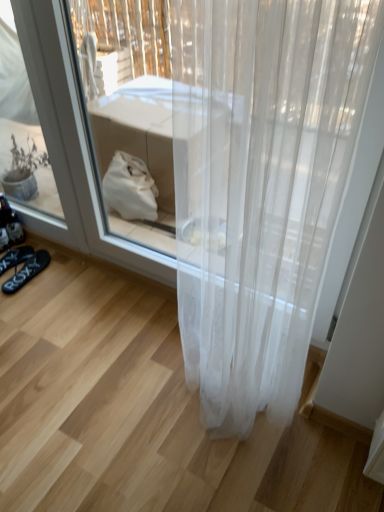
Question: Looking at their shapes, would you say black rubber flip-flops at lower left, arranged as the 2th footwear when viewed from the left, is wider or thinner than black rubber sandals at lower left, placed as the 1th footwear when sorted from left to right?

Choices:
 (A) thin
 (B) wide

Answer: (A)

Question: Is black rubber flip-flops at lower left, placed as the 1th footwear when sorted from right to left, bigger or smaller than black rubber sandals at lower left, placed as the 1th footwear when sorted from left to right?

Choices:
 (A) small
 (B) big

Answer: (B)

Question: Would you say black rubber flip-flops at lower left, arranged as the 2th footwear when viewed from the left, is to the left or to the right of black rubber sandals at lower left, placed as the 1th footwear when sorted from left to right, in the picture?

Choices:
 (A) left
 (B) right

Answer: (B)

Question: Considering the positions of black rubber sandals at lower left, placed as the 1th footwear when sorted from left to right, and black rubber flip-flops at lower left, placed as the 1th footwear when sorted from right to left, in the image, is black rubber sandals at lower left, placed as the 1th footwear when sorted from left to right, wider or thinner than black rubber flip-flops at lower left, placed as the 1th footwear when sorted from right to left,?

Choices:
 (A) thin
 (B) wide

Answer: (B)

Question: Is black rubber sandals at lower left, acting as the second footwear starting from the right, taller or shorter than black rubber flip-flops at lower left, placed as the 1th footwear when sorted from right to left?

Choices:
 (A) tall
 (B) short

Answer: (B)

Question: From the image's perspective, relative to black rubber flip-flops at lower left, arranged as the 2th footwear when viewed from the left, is black rubber sandals at lower left, placed as the 1th footwear when sorted from left to right, above or below?

Choices:
 (A) above
 (B) below

Answer: (A)

Question: Is black rubber sandals at lower left, placed as the 1th footwear when sorted from left to right, inside the boundaries of black rubber flip-flops at lower left, arranged as the 2th footwear when viewed from the left, or outside?

Choices:
 (A) inside
 (B) outside

Answer: (B)